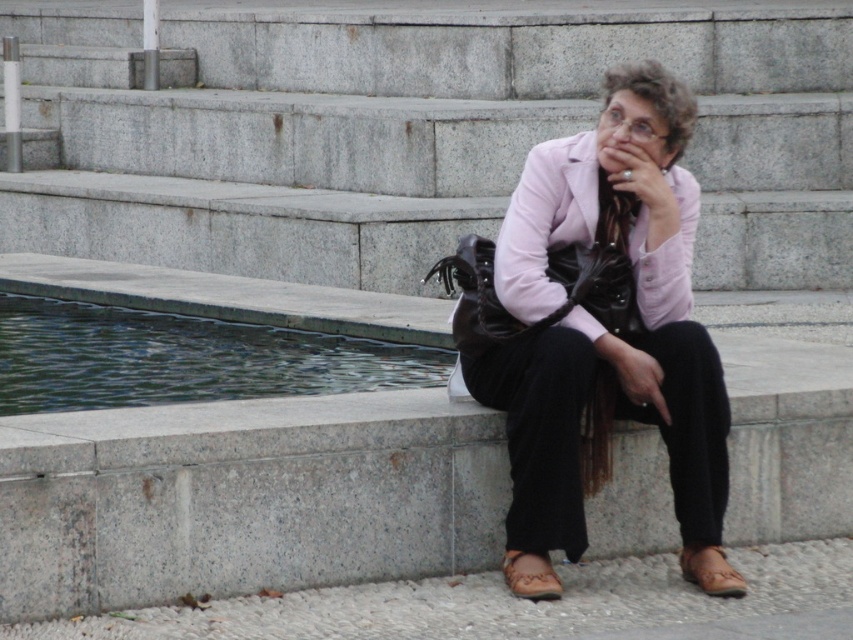
You are a delivery person who needs to place a small package on the brown leather sandal at lower center without getting the package wet. The green reflective water at lower left is nearby. Can you safely place the package on the sandal without it getting wet?

The distance between the green reflective water at lower left and the brown leather sandal at lower center is 6.27 feet. Since this distance is sufficient to keep the package away from the water, you can safely place the package on the brown leather sandal at lower center without it getting wet.

You are a photographer standing at the top of the stone steps behind the woman. You want to capture a photo of the matte pink blazer at center and the green reflective water at lower left in the same frame. Can you position yourself so that both objects are within your camera view without moving either object?

Yes, since the distance between the matte pink blazer at center and the green reflective water at lower left is 1.75 meters, positioning yourself at an angle that allows both objects to be in the camera frame while maintaining this distance would work.

You are a photographer trying to capture the woman from a low angle so that the brown leather sandal at lower center is visible without blocking the matte pink blazer at center. Is this possible based on their positions?

Yes, since the matte pink blazer at center is above the brown leather sandal at lower center, positioning the camera at a low angle would allow the sandal to be visible while keeping the blazer in view without obstruction.